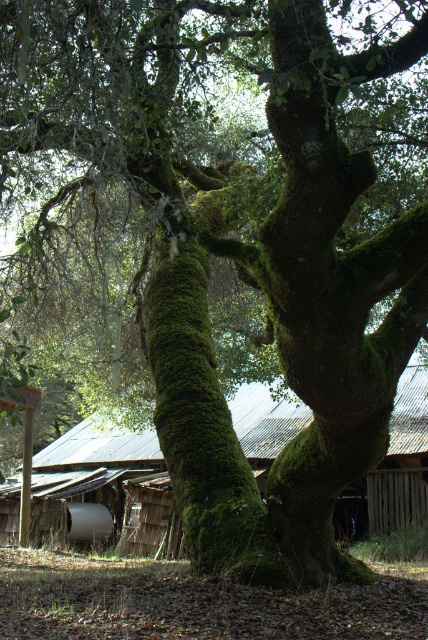
You are standing in the middle of the scene and want to walk towards the rusty corrugated metal hut at center and the green mossy tree trunk at center. Which one will you reach first?

You will reach the green mossy tree trunk at center first because it is closer to you than the rusty corrugated metal hut at center, which is further away.

You are a delivery person with a cart that is 10 feet wide. You need to navigate between the rusty corrugated metal hut at center and the green mossy tree trunk at center to reach the delivery point behind them. Can your cart fit through the space between them?

The rusty corrugated metal hut at center and green mossy tree trunk at center are 31.45 feet apart, so the 10 feet wide cart can easily pass through the space between them since the distance is much wider than the cart.

You are a painter standing at the edge of the scene. You want to paint both the rusty corrugated metal hut at center and the green mossy tree trunk at center. Which object should you focus on first if you want to paint the larger one first?

The rusty corrugated metal hut at center is larger in size than the green mossy tree trunk at center, so you should focus on painting the rusty corrugated metal hut at center first.